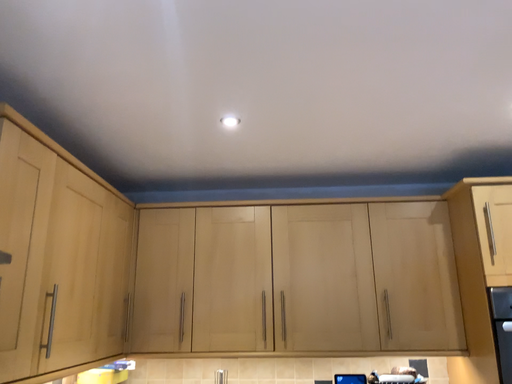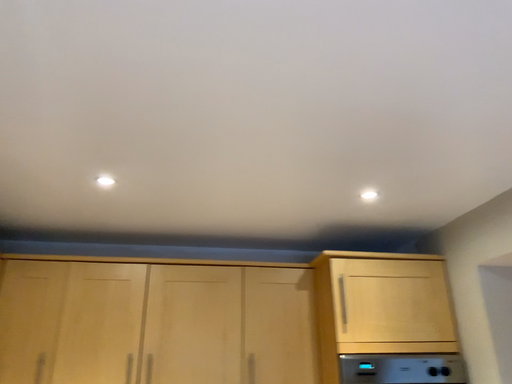
Question: Which way did the camera rotate in the video?

Choices:
 (A) rotated right
 (B) rotated left

Answer: (A)